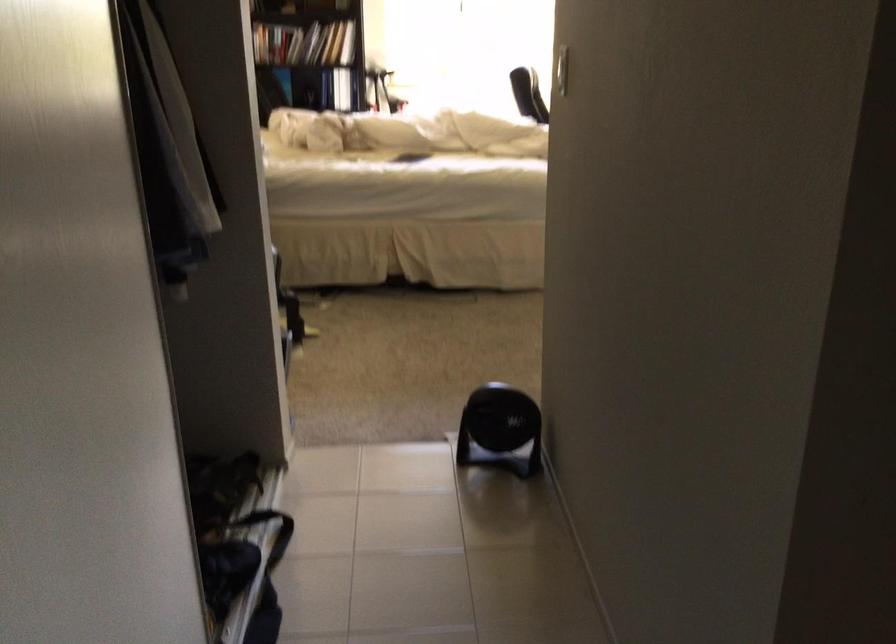
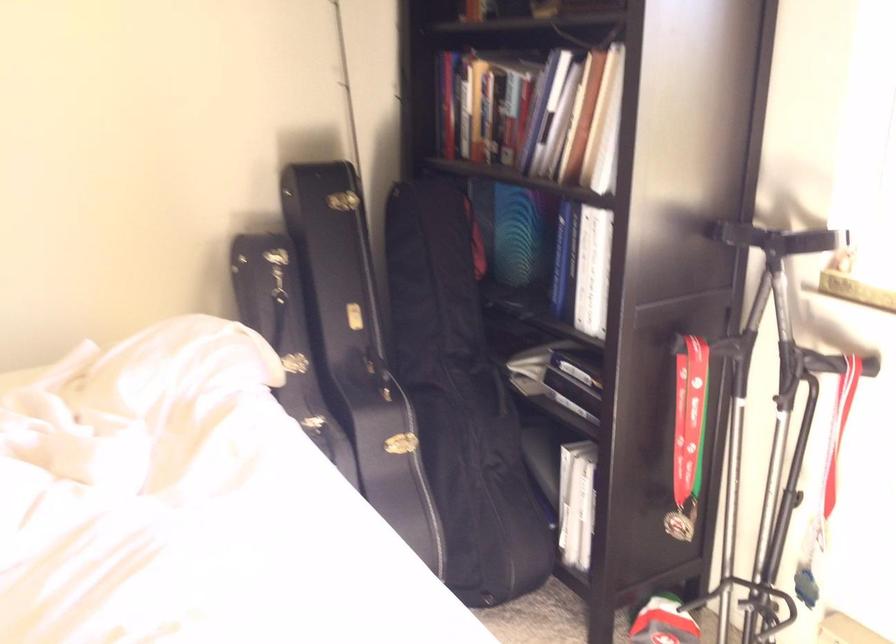
Locate, in the second image, the point that corresponds to [435,95] in the first image.

(839, 429)